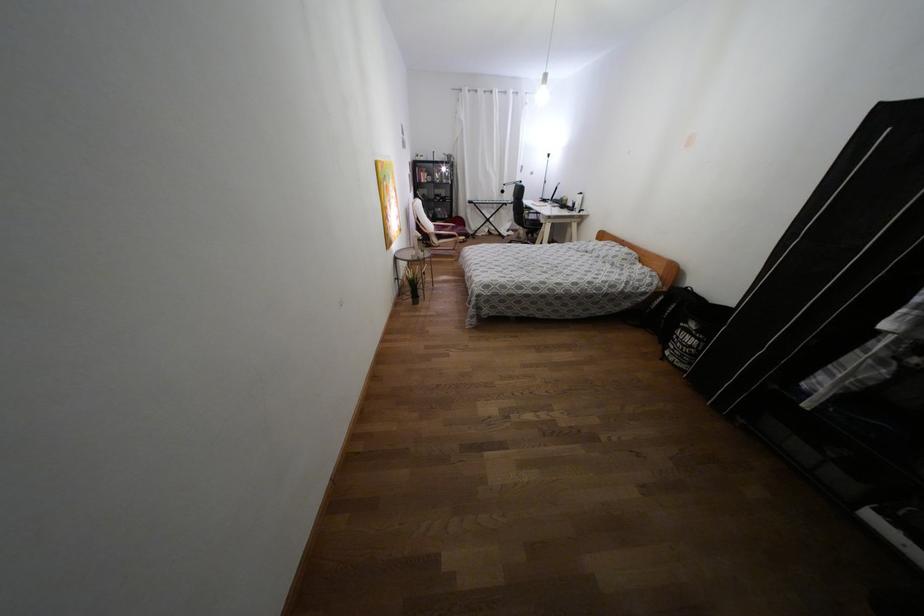
Locate an element on the screen. white chair sitting surface is located at coordinates (445, 241).